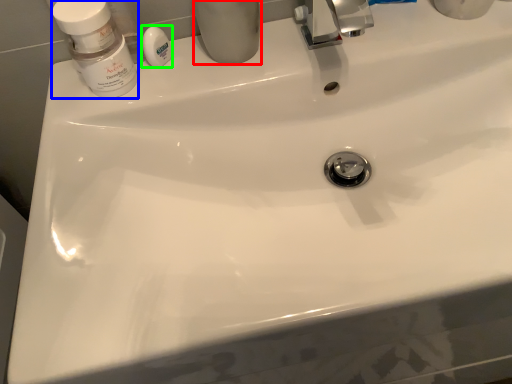
Question: Which object is positioned closest to toiletry (highlighted by a red box)? Select from mouthwash (highlighted by a blue box) and soap (highlighted by a green box).

Choices:
 (A) mouthwash
 (B) soap

Answer: (B)